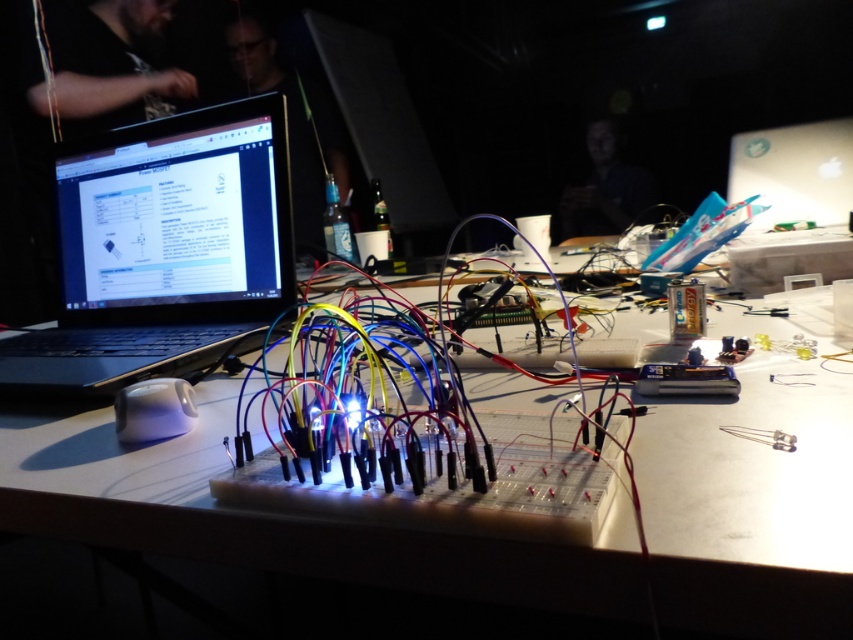
Question: Is white plastic table at center thinner than black matte laptop at left?

Choices:
 (A) yes
 (B) no

Answer: (B)

Question: Which of the following is the farthest from the observer?

Choices:
 (A) white plastic table at center
 (B) black matte laptop at left

Answer: (B)

Question: Can you confirm if white plastic table at center is wider than black matte laptop at left?

Choices:
 (A) yes
 (B) no

Answer: (A)

Question: Can you confirm if white plastic table at center is thinner than black matte laptop at left?

Choices:
 (A) yes
 (B) no

Answer: (B)

Question: Which point is farther from the camera taking this photo?

Choices:
 (A) (178, 192)
 (B) (663, 408)

Answer: (A)